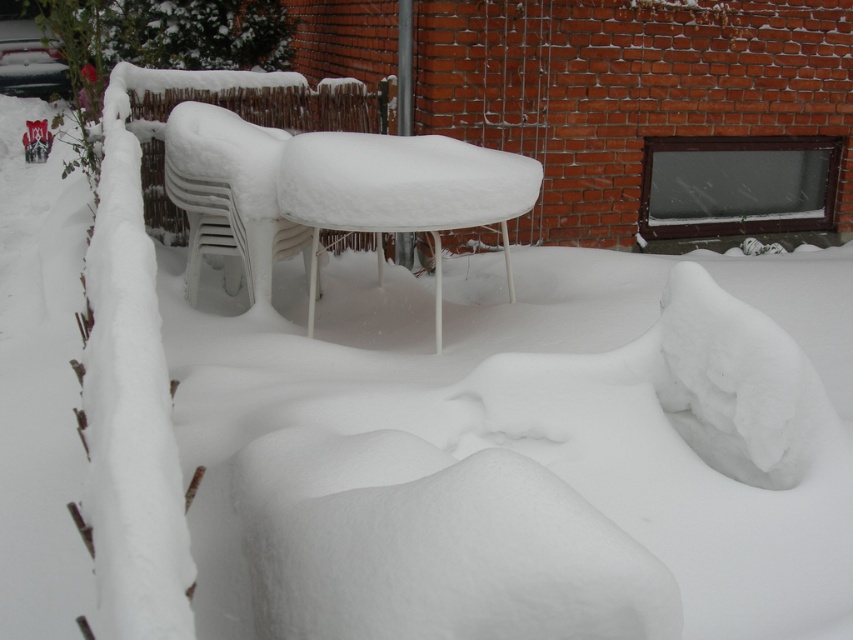
You are a snow removal worker and need to clear the snow from the white plastic table at center and the white plastic chair at center. Which object should you start with to avoid toppling over the taller one first?

The white plastic table at center is taller than the white plastic chair at center, so you should start by clearing the snow from the white plastic table at center first to avoid toppling over the taller one.

You are standing in a snowy backyard and want to reach the white plastic table at center. If your maximum reach is 2 meters, can you touch the table without moving closer?

The distance between you and the white plastic table at center is 2.88 meters, which exceeds your 2 meter reach. You cannot touch the table without moving closer.

You are standing in the snowy backyard and want to sit down. You see the white plastic table at center and the white plastic chair at center. Which object is closer to you?

The white plastic table at center is closer to you because it is in front of the white plastic chair at center.